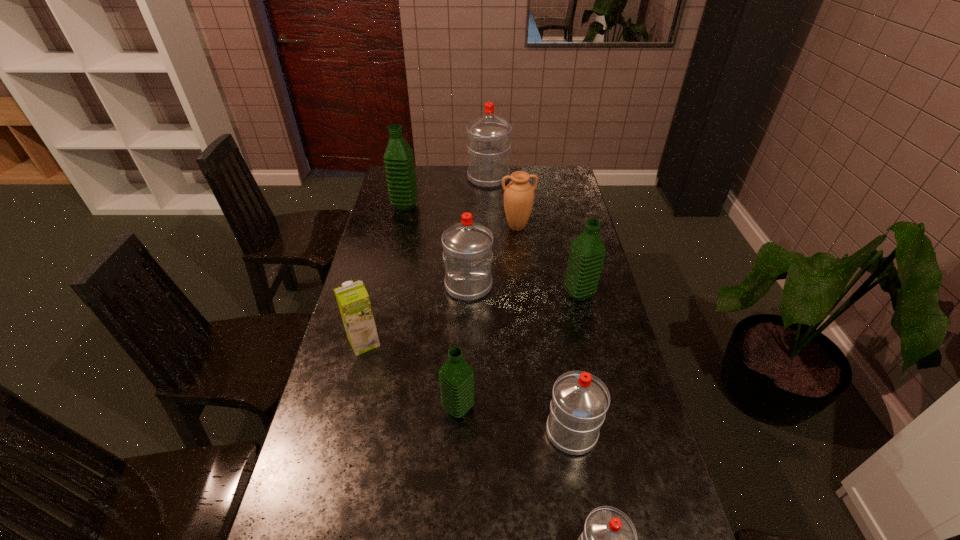
You are a GUI agent. You are given a task and a screenshot of the screen. Output one action in this format:
    pyautogui.click(x=<x>, y=<y>)
    Task: Click on the farthest object
    
    Given the screenshot: What is the action you would take?
    pyautogui.click(x=488, y=136)

Where is `the farthest water bottle`? the farthest water bottle is located at coordinates (488, 136).

The height and width of the screenshot is (540, 960). I want to click on the eighth nearest object, so click(399, 163).

Identify the location of the biggest green water bottle. Image resolution: width=960 pixels, height=540 pixels. (399, 163).

Find the location of `the third smallest white water bottle`. the third smallest white water bottle is located at coordinates (467, 246).

Identify the location of the second biggest green water bottle. Image resolution: width=960 pixels, height=540 pixels. (587, 252).

The height and width of the screenshot is (540, 960). Identify the location of the second farthest green water bottle. (587, 252).

Image resolution: width=960 pixels, height=540 pixels. I want to click on green soya milk, so click(353, 300).

You are a GUI agent. You are given a task and a screenshot of the screen. Output one action in this format:
    pyautogui.click(x=<x>, y=<y>)
    Task: Click on the fourth nearest object
    
    Given the screenshot: What is the action you would take?
    pyautogui.click(x=353, y=300)

What are the coordinates of `urn` in the screenshot? It's located at (519, 194).